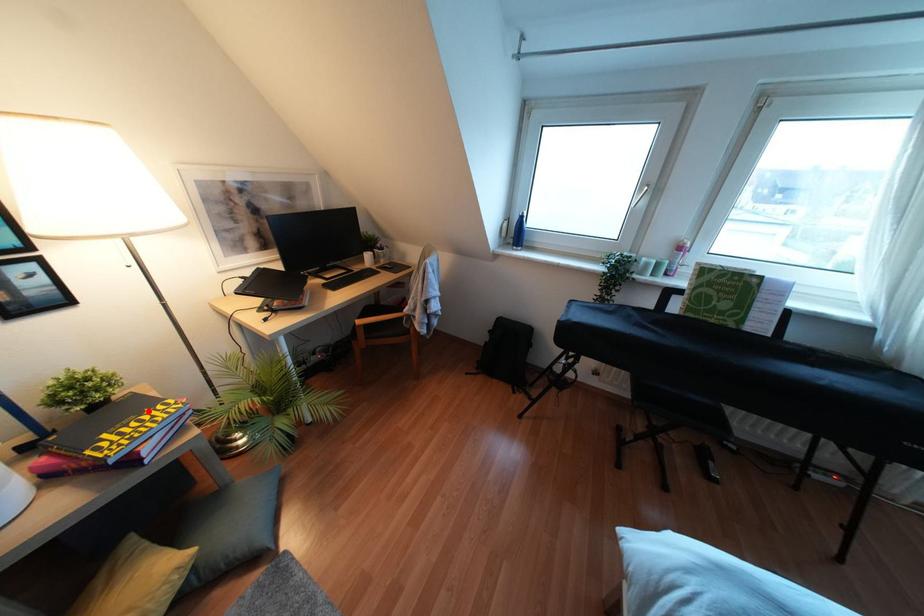
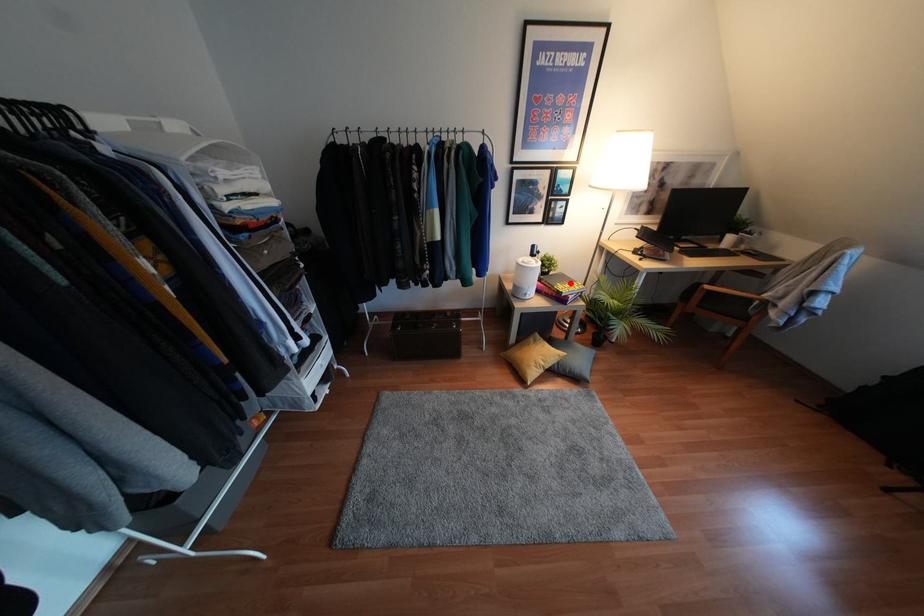
I am providing you with two images of the same scene from different viewpoints. A red point is marked on the first image and another point is marked on the second image. Is the marked point in image1 the same physical position as the marked point in image2?

Yes